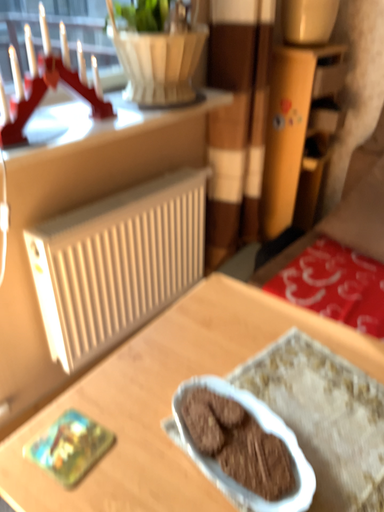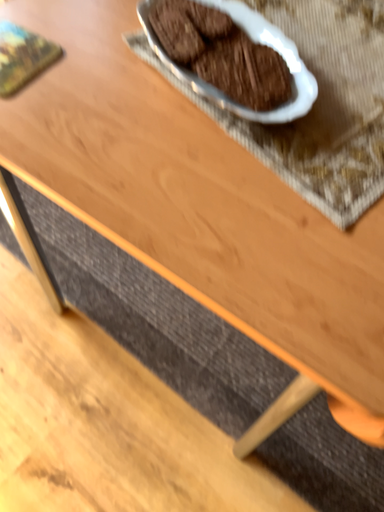
Question: How did the camera likely rotate when shooting the video?

Choices:
 (A) rotated downward
 (B) rotated upward

Answer: (A)